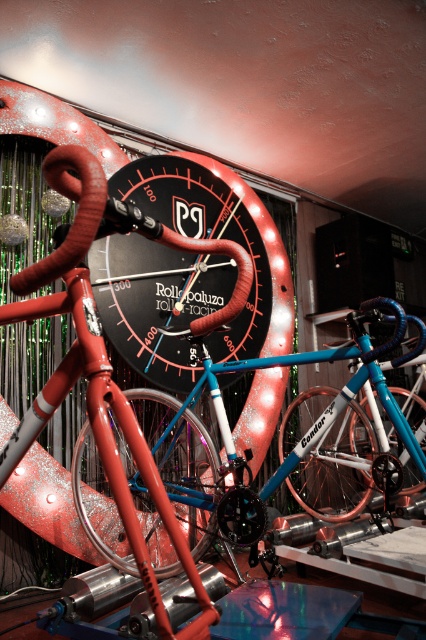
Can you confirm if shiny blue frame bicycle at center is thinner than metallic black clock at center?

In fact, shiny blue frame bicycle at center might be wider than metallic black clock at center.

Between shiny blue frame bicycle at center and metallic black clock at center, which one appears on the right side from the viewer's perspective?

shiny blue frame bicycle at center is more to the right.

This screenshot has height=640, width=426. What do you see at coordinates (282, 449) in the screenshot?
I see `shiny blue frame bicycle at center` at bounding box center [282, 449].

In order to click on shiny blue frame bicycle at center in this screenshot , I will do click(282, 449).